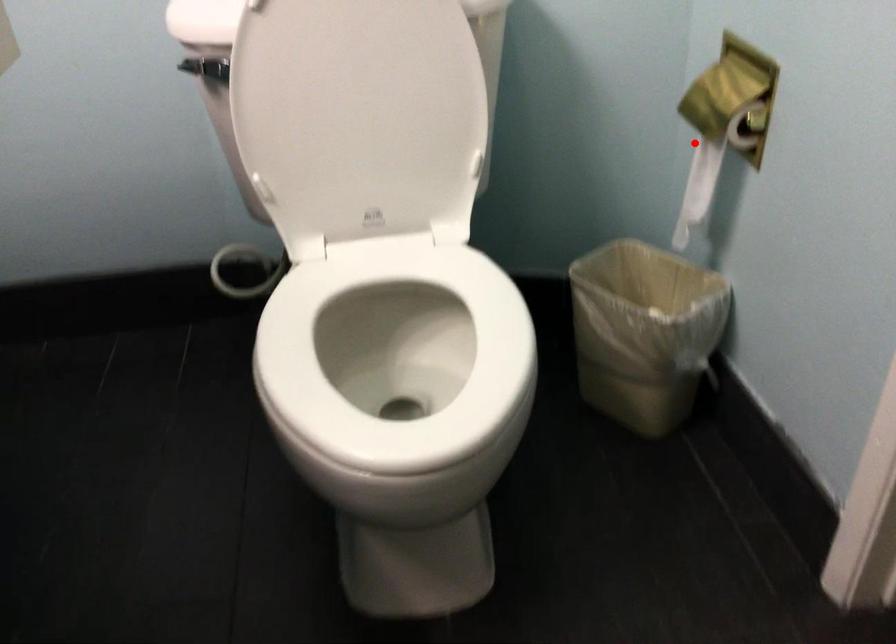
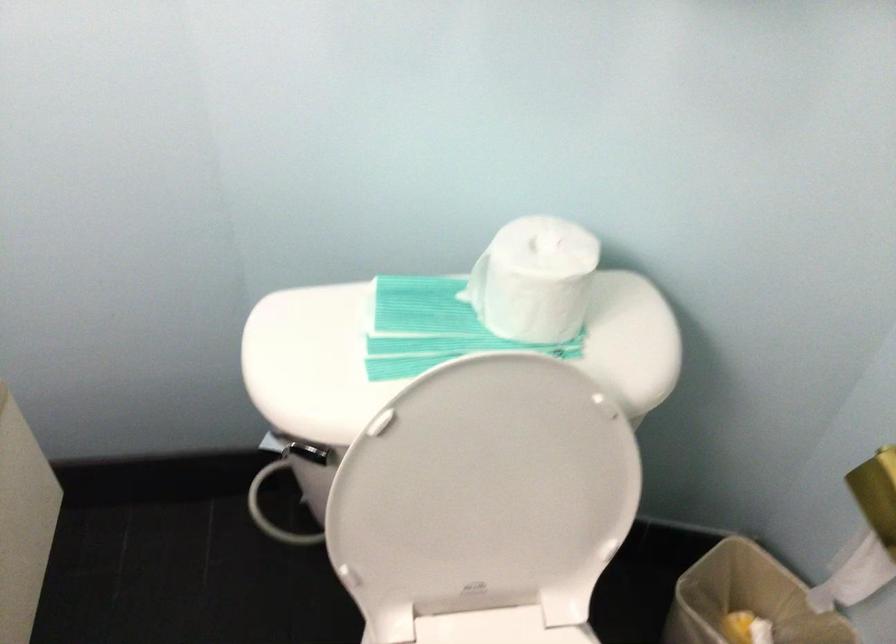
Where in the second image is the point corresponding to the highlighted location from the first image?

(866, 534)